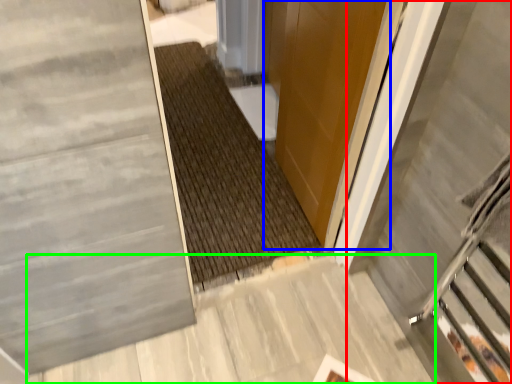
Question: Which is nearer to the escalator (highlighted by a red box)? door (highlighted by a blue box) or concrete (highlighted by a green box).

Choices:
 (A) door
 (B) concrete

Answer: (A)